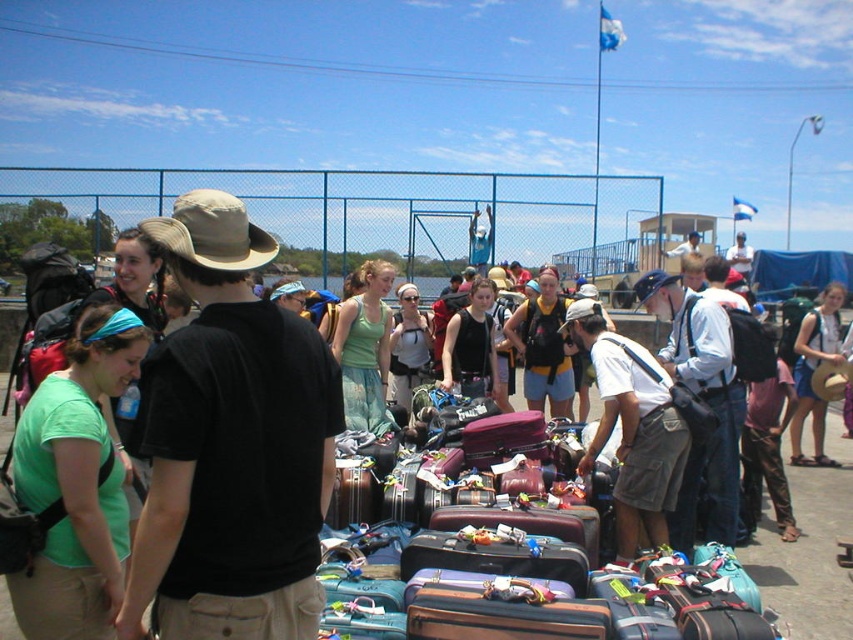
Between multicolored fabric suitcase at center and green cotton tank top at center, which one appears on the right side from the viewer's perspective?

Positioned to the right is multicolored fabric suitcase at center.

Is point (463, 586) farther from camera compared to point (364, 280)?

No, (463, 586) is in front of (364, 280).

Which is in front, point (527, 516) or point (340, 324)?

Point (527, 516)

Where is `multicolored fabric suitcase at center`? This screenshot has height=640, width=853. multicolored fabric suitcase at center is located at coordinates (548, 593).

Between black cotton shirt at center and matte white tank top at center, which one appears on the left side from the viewer's perspective?

Positioned to the left is black cotton shirt at center.

Locate an element on the screen. black cotton shirt at center is located at coordinates (231, 444).

This screenshot has width=853, height=640. I want to click on black cotton shirt at center, so click(x=231, y=444).

Who is higher up, multicolored fabric suitcase at center or matte white tank top at center?

matte white tank top at center

Who is lower down, multicolored fabric suitcase at center or matte white tank top at center?

multicolored fabric suitcase at center is below.

Who is more forward, (693, 616) or (425, 374)?

Point (693, 616) is in front.

Where is `multicolored fabric suitcase at center`? This screenshot has height=640, width=853. multicolored fabric suitcase at center is located at coordinates (548, 593).